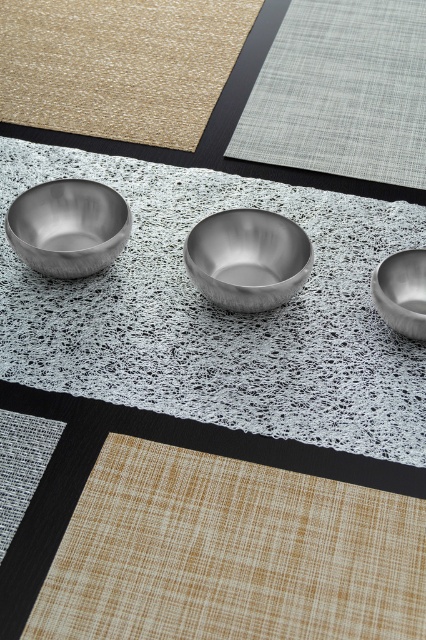
Is metallic silver bowls at center shorter than light gray woven mat at upper center?

Yes.

Can you confirm if metallic silver bowls at center is positioned to the left of light gray woven mat at upper center?

Indeed, metallic silver bowls at center is positioned on the left side of light gray woven mat at upper center.

Which is in front, point (169, 177) or point (330, 129)?

Positioned in front is point (169, 177).

Identify the location of metallic silver bowls at center. The image size is (426, 640). (219, 312).

Does metallic silver bowls at center have a lesser width compared to polished silver bowl at right?

Incorrect, metallic silver bowls at center's width is not less than polished silver bowl at right's.

Which of these two, metallic silver bowls at center or polished silver bowl at right, stands shorter?

polished silver bowl at right is shorter.

Image resolution: width=426 pixels, height=640 pixels. Identify the location of metallic silver bowls at center. (219, 312).

Is metallic silver bowls at center thinner than beige woven mat at lower left?

In fact, metallic silver bowls at center might be wider than beige woven mat at lower left.

From the picture: Can you confirm if metallic silver bowls at center is positioned above beige woven mat at lower left?

Yes.

Is point (152, 205) more distant than point (268, 576)?

Yes, point (152, 205) is behind point (268, 576).

I want to click on metallic silver bowls at center, so click(x=219, y=312).